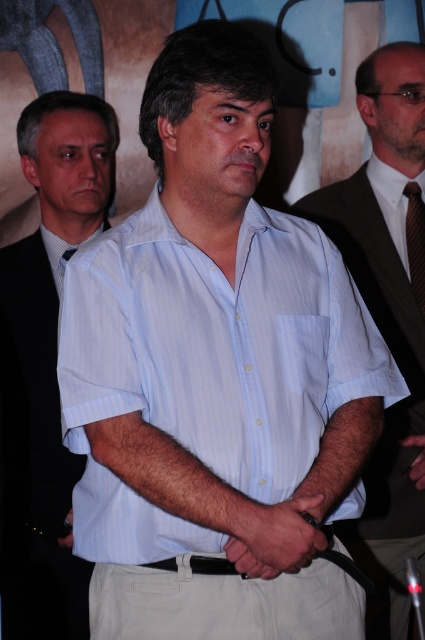
Is white striped shirt at center shorter than black leather belt at lower left?

In fact, white striped shirt at center may be taller than black leather belt at lower left.

Can you confirm if white striped shirt at center is positioned to the left of black leather belt at lower left?

Yes, white striped shirt at center is to the left of black leather belt at lower left.

Where is `white striped shirt at center`? The image size is (425, 640). white striped shirt at center is located at coordinates (45, 364).

Is point (367, 276) positioned before point (421, 477)?

No, it is not.

Who is taller, light blue striped shirt at center or black leather hand at center?

light blue striped shirt at center

The image size is (425, 640). Identify the location of light blue striped shirt at center. (385, 314).

This screenshot has width=425, height=640. Identify the location of light blue striped shirt at center. (385, 314).

Does white striped shirt at center have a lesser width compared to smooth skin hands at center?

Incorrect, white striped shirt at center's width is not less than smooth skin hands at center's.

Is white striped shirt at center to the right of smooth skin hands at center from the viewer's perspective?

No, white striped shirt at center is not to the right of smooth skin hands at center.

Which is behind, point (110, 116) or point (234, 525)?

Point (110, 116)

The image size is (425, 640). I want to click on white striped shirt at center, so click(45, 364).